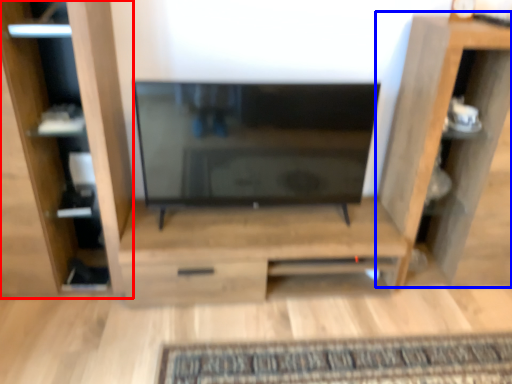
Question: Which object appears farthest to the camera in this image, furniture (highlighted by a red box) or shelf (highlighted by a blue box)?

Choices:
 (A) furniture
 (B) shelf

Answer: (B)